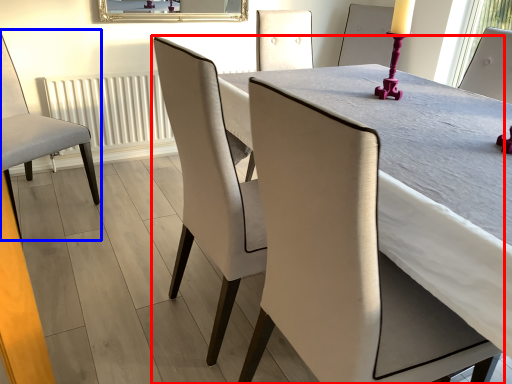
Question: Which object is closer to the camera taking this photo, chair (highlighted by a red box) or chair (highlighted by a blue box)?

Choices:
 (A) chair
 (B) chair

Answer: (A)